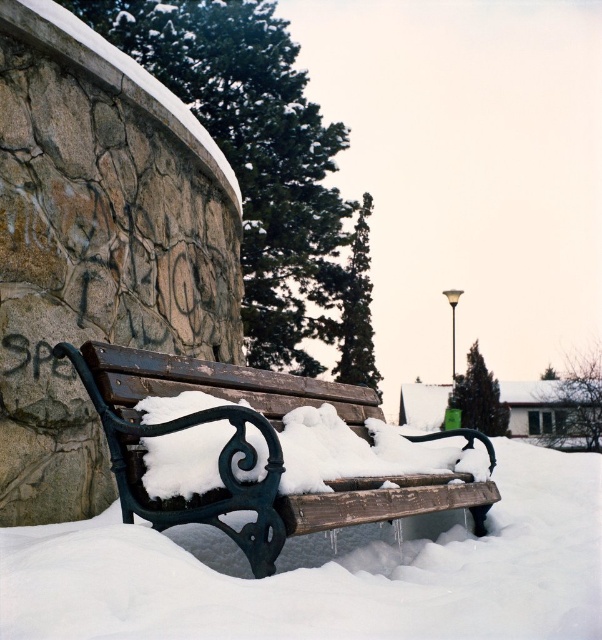
Which is more to the right, white fluffy snow at center or wooden bench at center?

From the viewer's perspective, white fluffy snow at center appears more on the right side.

Does white fluffy snow at center appear on the right side of wooden bench at center?

Correct, you'll find white fluffy snow at center to the right of wooden bench at center.

Does point (500, 596) come closer to viewer compared to point (184, 520)?

Yes.

Find the location of a particular element. white fluffy snow at center is located at coordinates (326, 572).